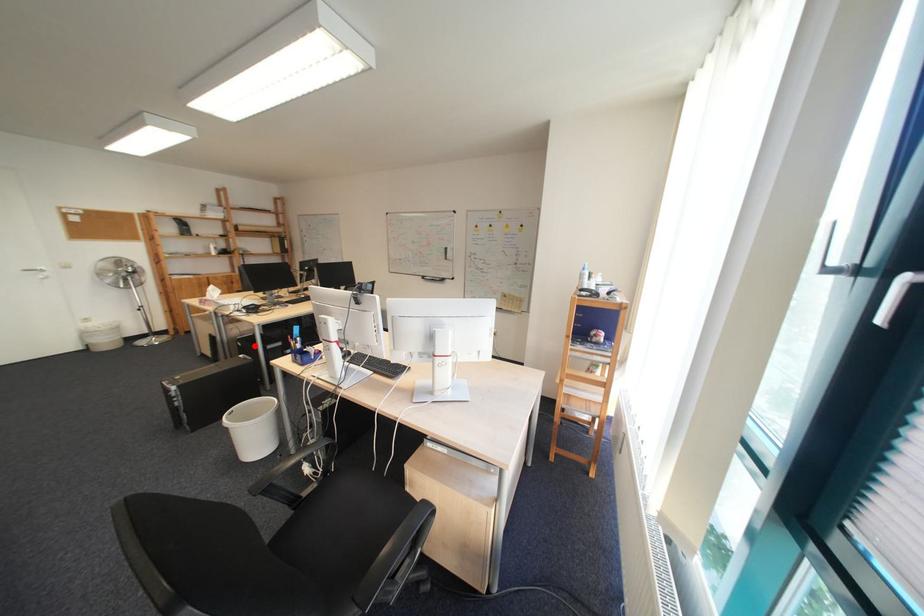
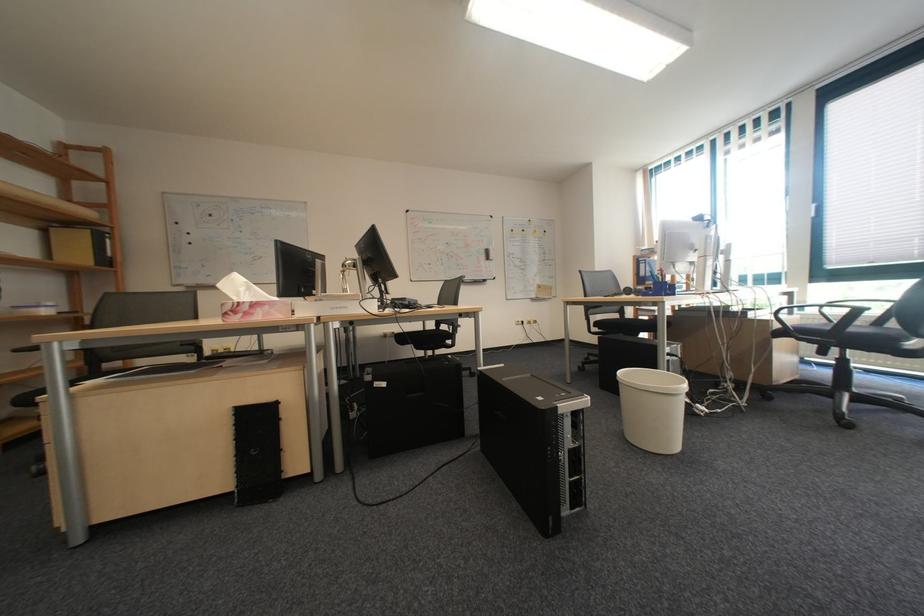
Where in the second image is the point corresponding to the highlighted location from the first image?

(398, 386)